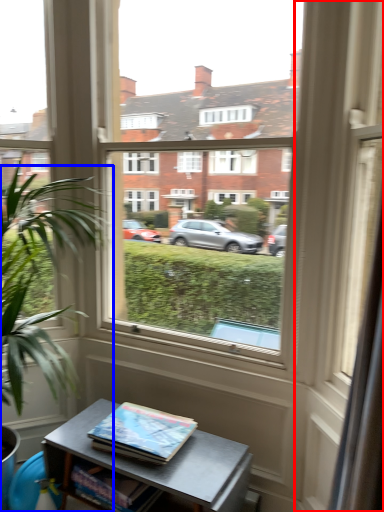
Question: Which point is further to the camera, glass door (highlighted by a red box) or houseplant (highlighted by a blue box)?

Choices:
 (A) glass door
 (B) houseplant

Answer: (B)